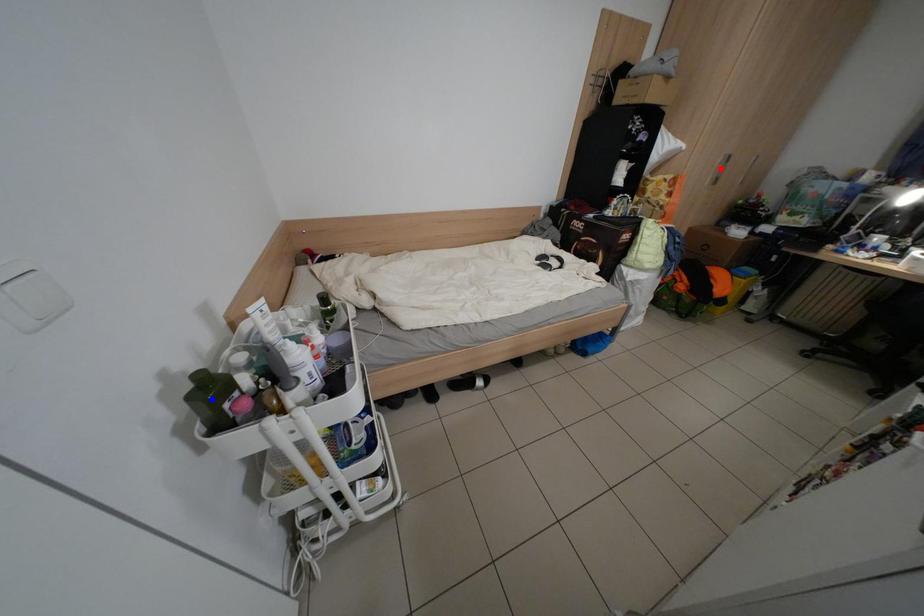
Question: In the image, two points are highlighted. Which point is nearer to the camera? Reply with the corresponding letter.

Choices:
 (A) blue point
 (B) red point

Answer: (A)